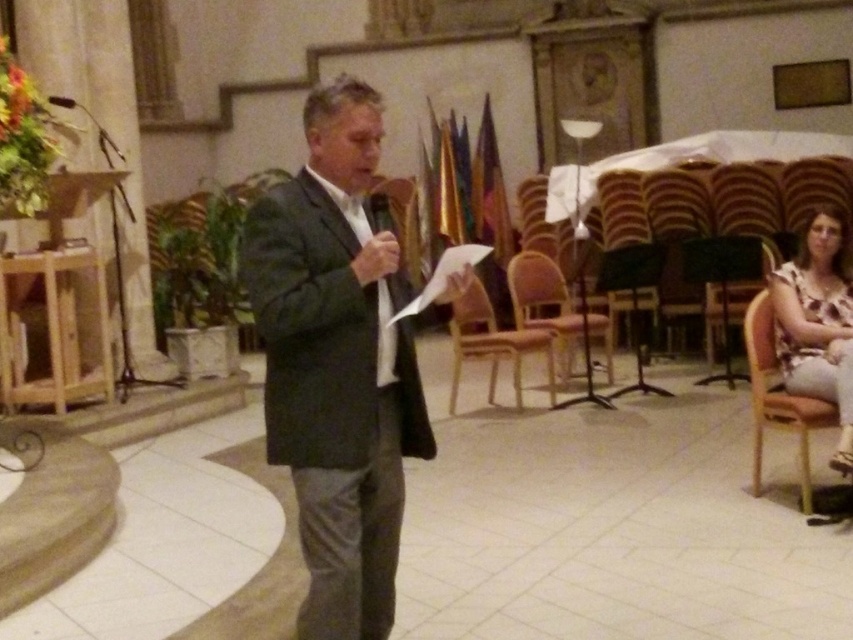
Question: Among these points, which one is farthest from the camera?

Choices:
 (A) (555, 300)
 (B) (828, 307)
 (C) (511, 342)

Answer: (A)

Question: Which of the following is the closest to the observer?

Choices:
 (A) (462, 333)
 (B) (341, 106)
 (C) (65, 104)
 (D) (724, 324)

Answer: (B)

Question: Considering the relative positions of light brown wooden chair at center and black matte microphone at upper left in the image provided, where is light brown wooden chair at center located with respect to black matte microphone at upper left?

Choices:
 (A) left
 (B) right

Answer: (B)

Question: Is printed fabric blouse at right closer to the viewer compared to wooden chair at right?

Choices:
 (A) no
 (B) yes

Answer: (B)

Question: Does dark gray suit at center appear on the left side of light brown wooden chair at center?

Choices:
 (A) no
 (B) yes

Answer: (B)

Question: Which of these objects is positioned closest to the printed fabric blouse at right?

Choices:
 (A) dark gray suit at center
 (B) metallic gold chair at center
 (C) wooden chair at center

Answer: (C)